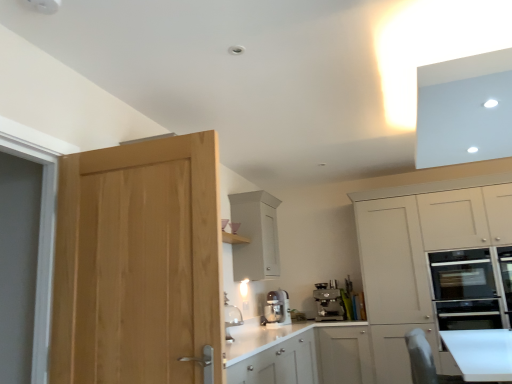
Question: From the image's perspective, is white matte cabinet at right, acting as the second cabinetry starting from the left, located beneath white matte cabinet at upper center, which ranks as the 1th cabinetry in left-to-right order?

Choices:
 (A) yes
 (B) no

Answer: (A)

Question: From a real-world perspective, does white matte cabinet at right, which is the 1th cabinetry from right to left, stand above white matte cabinet at upper center, which ranks as the 1th cabinetry in left-to-right order?

Choices:
 (A) yes
 (B) no

Answer: (B)

Question: Is white matte cabinet at right, which is the 1th cabinetry from right to left, at the right side of white matte cabinet at upper center, which ranks as the 1th cabinetry in left-to-right order?

Choices:
 (A) no
 (B) yes

Answer: (B)

Question: Is white matte cabinet at right, acting as the second cabinetry starting from the left, bigger than white matte cabinet at upper center, which is counted as the second cabinetry, starting from the right?

Choices:
 (A) no
 (B) yes

Answer: (B)

Question: Is white matte cabinet at right, which is the 1th cabinetry from right to left, taller than white matte cabinet at upper center, which is counted as the second cabinetry, starting from the right?

Choices:
 (A) yes
 (B) no

Answer: (A)

Question: Is white matte cabinet at right, which is the 1th cabinetry from right to left, far away from white matte cabinet at upper center, which is counted as the second cabinetry, starting from the right?

Choices:
 (A) no
 (B) yes

Answer: (B)

Question: Does white matte cabinet at upper center, which is counted as the second cabinetry, starting from the right, come behind satin silver mixer at center, the 1th kitchen appliance in the left-to-right sequence?

Choices:
 (A) yes
 (B) no

Answer: (B)

Question: Is white matte cabinet at upper center, which is counted as the second cabinetry, starting from the right, not near satin silver mixer at center, the second kitchen appliance viewed from the right?

Choices:
 (A) no
 (B) yes

Answer: (A)

Question: Can you confirm if white matte cabinet at upper center, which is counted as the second cabinetry, starting from the right, is wider than satin silver mixer at center, the 1th kitchen appliance in the left-to-right sequence?

Choices:
 (A) yes
 (B) no

Answer: (A)

Question: Could you tell me if white matte cabinet at upper center, which ranks as the 1th cabinetry in left-to-right order, is facing satin silver mixer at center, the second kitchen appliance viewed from the right?

Choices:
 (A) yes
 (B) no

Answer: (B)

Question: Does white matte cabinet at upper center, which ranks as the 1th cabinetry in left-to-right order, contain satin silver mixer at center, the second kitchen appliance viewed from the right?

Choices:
 (A) yes
 (B) no

Answer: (B)

Question: Does white matte cabinet at upper center, which ranks as the 1th cabinetry in left-to-right order, have a greater height compared to satin silver mixer at center, the 1th kitchen appliance in the left-to-right sequence?

Choices:
 (A) no
 (B) yes

Answer: (B)

Question: From the image's perspective, would you say natural wood door at left is shown under satin silver mixer at center, the second kitchen appliance viewed from the right?

Choices:
 (A) yes
 (B) no

Answer: (B)